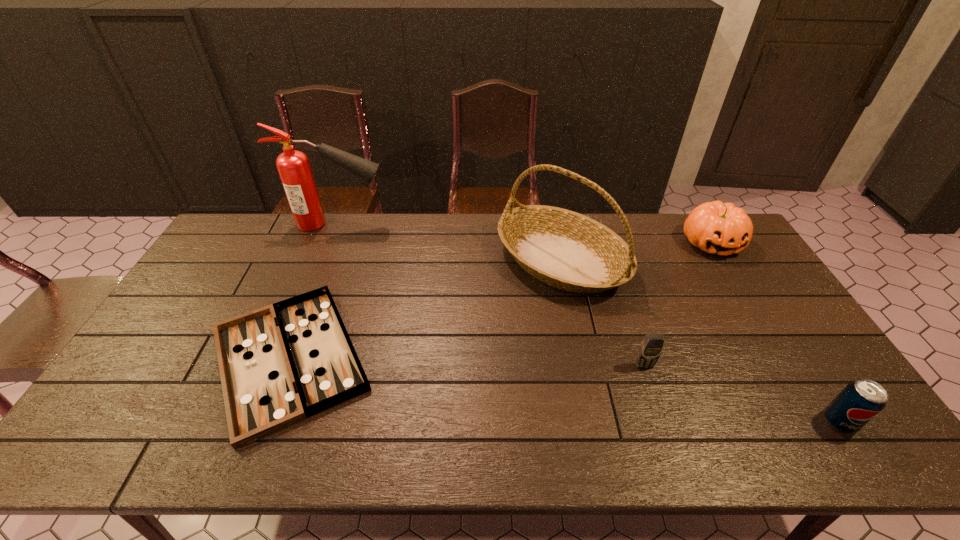
In order to click on fire extinguisher in this screenshot , I will do `click(293, 166)`.

Identify the location of basket. (564, 249).

Find the location of `pumpkin`. pumpkin is located at coordinates (719, 228).

Identify the location of soda can. The height and width of the screenshot is (540, 960). (861, 400).

Where is `cellular telephone`? cellular telephone is located at coordinates (651, 347).

Image resolution: width=960 pixels, height=540 pixels. Identify the location of the shortest object. (280, 364).

Locate an element on the screen. The width and height of the screenshot is (960, 540). vacant space located 0.070m at the nozzle of the fire extinguisher is located at coordinates (407, 224).

This screenshot has width=960, height=540. What are the coordinates of `vacant area situated 0.310m on the front of the basket` in the screenshot? It's located at point(588,396).

The height and width of the screenshot is (540, 960). I want to click on free region located 0.090m on the carved face of the pumpkin, so click(735, 281).

Locate an element on the screen. vacant region located 0.320m on the left of the soda can is located at coordinates [691, 422].